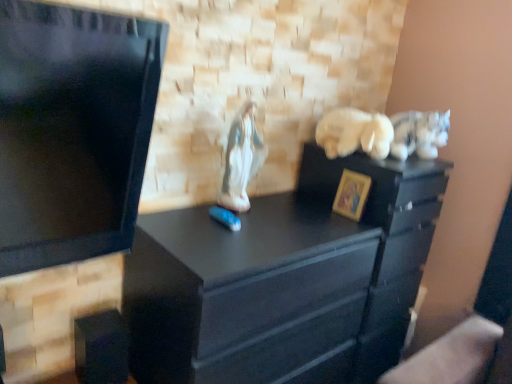
Question: Is gold painted wood picture frame at center right not near white plush bear at upper right, the 2th animal in the left-to-right sequence?

Choices:
 (A) no
 (B) yes

Answer: (A)

Question: Is gold painted wood picture frame at center right beside white plush bear at upper right, the 2th animal in the left-to-right sequence?

Choices:
 (A) no
 (B) yes

Answer: (A)

Question: From a real-world perspective, is gold painted wood picture frame at center right physically below white plush bear at upper right, the 2th animal in the left-to-right sequence?

Choices:
 (A) yes
 (B) no

Answer: (A)

Question: Is gold painted wood picture frame at center right behind white plush bear at upper right, the 2th animal in the left-to-right sequence?

Choices:
 (A) no
 (B) yes

Answer: (B)

Question: Does gold painted wood picture frame at center right have a greater width compared to white plush bear at upper right, the 2th animal in the left-to-right sequence?

Choices:
 (A) yes
 (B) no

Answer: (B)

Question: Does gold painted wood picture frame at center right have a lesser height compared to white plush bear at upper right, arranged as the 2th animal when viewed from the right?

Choices:
 (A) no
 (B) yes

Answer: (A)

Question: Can you confirm if gold painted wood picture frame at center right is taller than porcelain statue at center, which is the 3th animal in right-to-left order?

Choices:
 (A) no
 (B) yes

Answer: (A)

Question: Could you tell me if gold painted wood picture frame at center right is facing porcelain statue at center, which is the 3th animal in right-to-left order?

Choices:
 (A) yes
 (B) no

Answer: (B)

Question: From a real-world perspective, is gold painted wood picture frame at center right on porcelain statue at center, the first animal viewed from the left?

Choices:
 (A) no
 (B) yes

Answer: (A)

Question: From the image's perspective, is gold painted wood picture frame at center right under porcelain statue at center, which is the 3th animal in right-to-left order?

Choices:
 (A) no
 (B) yes

Answer: (B)

Question: Is gold painted wood picture frame at center right directly adjacent to porcelain statue at center, which is the 3th animal in right-to-left order?

Choices:
 (A) no
 (B) yes

Answer: (A)

Question: Can you confirm if gold painted wood picture frame at center right is positioned to the left of porcelain statue at center, which is the 3th animal in right-to-left order?

Choices:
 (A) yes
 (B) no

Answer: (B)

Question: From the image's perspective, does white plush cat at upper right, arranged as the third animal when viewed from the left, appear higher than porcelain statue at center, which is the 3th animal in right-to-left order?

Choices:
 (A) no
 (B) yes

Answer: (B)